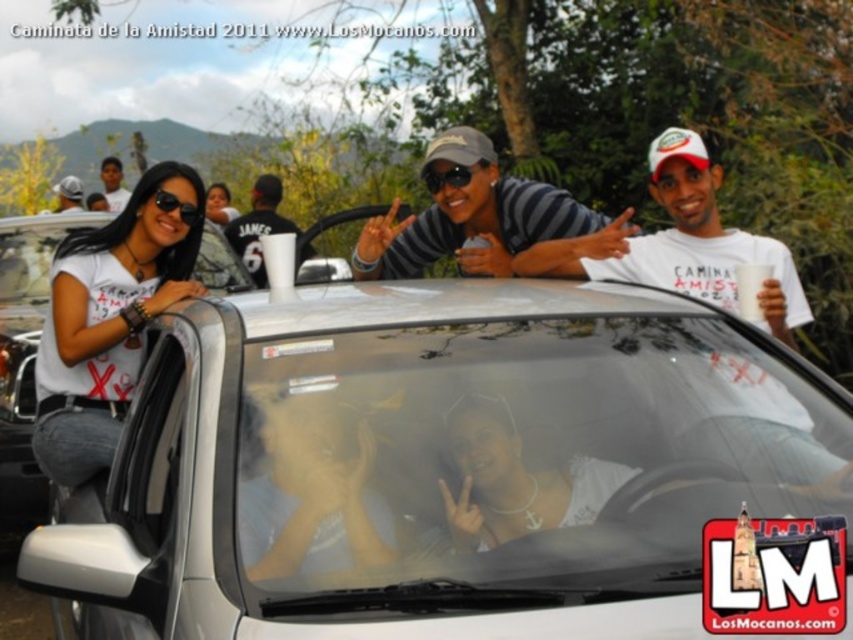
Question: Which object is the closest to the gray striped shirt at center?

Choices:
 (A) matte black shirt at upper left
 (B) matte black sunglasses at upper left
 (C) white pearl necklace at center
 (D) black jersey at center

Answer: (C)

Question: Is silver metallic car at center positioned behind gray striped shirt at center?

Choices:
 (A) no
 (B) yes

Answer: (A)

Question: Is the position of white pearl necklace at center less distant than that of matte black sunglasses at upper left?

Choices:
 (A) no
 (B) yes

Answer: (B)

Question: Among these points, which one is nearest to the camera?

Choices:
 (A) (257, 246)
 (B) (666, 452)

Answer: (B)

Question: Which object is the closest to the black plastic sunglasses at center?

Choices:
 (A) matte black cap at upper left
 (B) matte white t-shirt at left

Answer: (B)

Question: Does matte white t-shirt at left appear over black jersey at center?

Choices:
 (A) no
 (B) yes

Answer: (A)